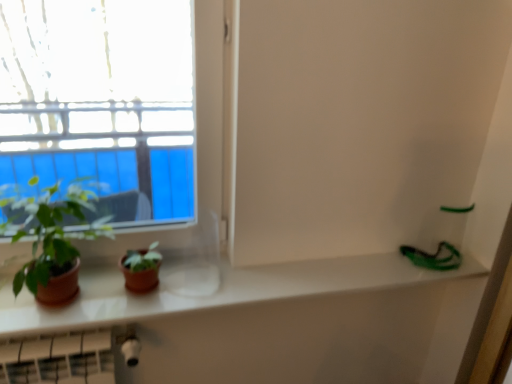
Question: Is green matte plant at left facing towards white glossy counter top at center?

Choices:
 (A) yes
 (B) no

Answer: (B)

Question: Is green matte plant at left not close to white glossy counter top at center?

Choices:
 (A) no
 (B) yes

Answer: (A)

Question: From a real-world perspective, is green matte plant at left located higher than white glossy counter top at center?

Choices:
 (A) yes
 (B) no

Answer: (A)

Question: From the image's perspective, is green matte plant at left below white glossy counter top at center?

Choices:
 (A) no
 (B) yes

Answer: (A)

Question: Is green matte plant at left not inside white glossy counter top at center?

Choices:
 (A) no
 (B) yes

Answer: (B)

Question: Is green matte plant at left shorter than white glossy counter top at center?

Choices:
 (A) yes
 (B) no

Answer: (B)

Question: Considering the relative positions of white glossy counter top at center and green matte plant at left in the image provided, is white glossy counter top at center behind green matte plant at left?

Choices:
 (A) yes
 (B) no

Answer: (A)

Question: Is white glossy counter top at center outside of green matte plant at left?

Choices:
 (A) no
 (B) yes

Answer: (B)

Question: Could green matte plant at left be considered to be inside white glossy counter top at center?

Choices:
 (A) no
 (B) yes

Answer: (A)

Question: Does white glossy counter top at center have a smaller size compared to green matte plant at left?

Choices:
 (A) yes
 (B) no

Answer: (A)

Question: Considering the relative sizes of white glossy counter top at center and green matte plant at left in the image provided, is white glossy counter top at center taller than green matte plant at left?

Choices:
 (A) yes
 (B) no

Answer: (B)

Question: From the image's perspective, does white glossy counter top at center appear lower than green matte plant at left?

Choices:
 (A) no
 (B) yes

Answer: (B)

Question: Choose the correct answer: Is white glossy counter top at center inside green matte plant at left or outside it?

Choices:
 (A) inside
 (B) outside

Answer: (B)